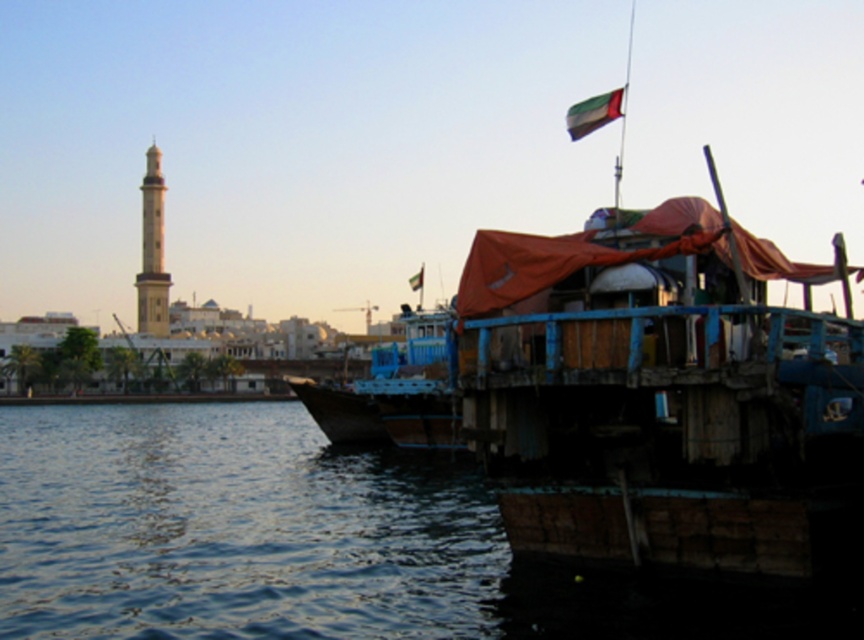
Which is more to the right, smooth beige tower at left or red fabric flag at upper right?

From the viewer's perspective, red fabric flag at upper right appears more on the right side.

Describe the element at coordinates (151, 252) in the screenshot. I see `smooth beige tower at left` at that location.

The image size is (864, 640). In order to click on smooth beige tower at left in this screenshot , I will do pos(151,252).

Locate an element on the screen. The width and height of the screenshot is (864, 640). smooth beige tower at left is located at coordinates (151, 252).

Between smooth beige tower at left and green fabric flag at upper right, which one is positioned lower?

Positioned lower is smooth beige tower at left.

Is point (162, 320) closer to viewer compared to point (621, 115)?

No, it is not.

Where is `smooth beige tower at left`? This screenshot has width=864, height=640. smooth beige tower at left is located at coordinates (151, 252).

Is point (224, 552) less distant than point (415, 289)?

Yes, point (224, 552) is closer to viewer.

Does transparent water at lower left have a larger size compared to red fabric flag at upper right?

Correct, transparent water at lower left is larger in size than red fabric flag at upper right.

Identify the location of transparent water at lower left. (305, 541).

The image size is (864, 640). Identify the location of transparent water at lower left. (305, 541).